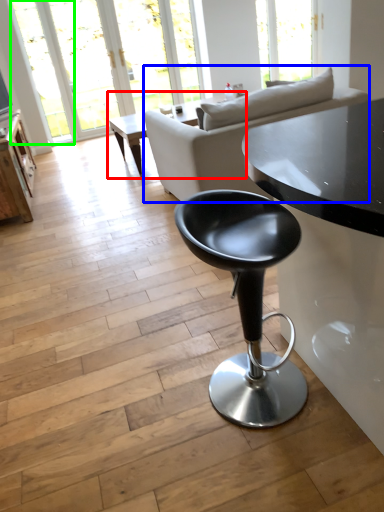
Question: Which is nearer to the coffee table (highlighted by a red box)? studio couch (highlighted by a blue box) or window (highlighted by a green box).

Choices:
 (A) studio couch
 (B) window

Answer: (B)